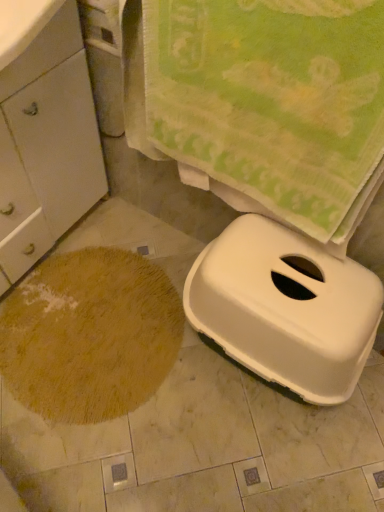
What is the approximate width of brown shaggy rug at lower left?

brown shaggy rug at lower left is 59.47 centimeters in width.

The image size is (384, 512). What do you see at coordinates (46, 145) in the screenshot?
I see `white matte cabinet at left` at bounding box center [46, 145].

You are a GUI agent. You are given a task and a screenshot of the screen. Output one action in this format:
    pyautogui.click(x=<x>, y=<y>)
    Task: Click on the white matte cabinet at left
    
    Given the screenshot: What is the action you would take?
    pyautogui.click(x=46, y=145)

You are a GUI agent. You are given a task and a screenshot of the screen. Output one action in this format:
    pyautogui.click(x=<x>, y=<y>)
    Task: Click on the green textured towel at upper center
    This screenshot has height=512, width=384.
    Given the screenshot: What is the action you would take?
    pyautogui.click(x=263, y=103)

The width and height of the screenshot is (384, 512). I want to click on brown shaggy rug at lower left, so click(x=90, y=335).

Considering the sizes of white matte cabinet at left and white plastic litter box at lower right in the image, is white matte cabinet at left wider or thinner than white plastic litter box at lower right?

In the image, white matte cabinet at left appears to be more narrow than white plastic litter box at lower right.

Is white matte cabinet at left turned away from white plastic litter box at lower right?

That's not correct — white matte cabinet at left is not looking away from white plastic litter box at lower right.

In order to click on appliance below the white matte cabinet at left (from a real-world perspective) in this screenshot , I will do `click(285, 308)`.

Considering the sizes of objects white matte cabinet at left and white plastic litter box at lower right in the image provided, who is smaller, white matte cabinet at left or white plastic litter box at lower right?

white plastic litter box at lower right.

Considering the relative positions of white matte cabinet at left and brown shaggy rug at lower left in the image provided, is white matte cabinet at left to the right of brown shaggy rug at lower left from the viewer's perspective?

No.

From the image's perspective, is white matte cabinet at left located beneath brown shaggy rug at lower left?

No.

How different are the orientations of white matte cabinet at left and brown shaggy rug at lower left in degrees?

3.28 degrees.

Which of these two, white matte cabinet at left or brown shaggy rug at lower left, stands taller?

With more height is white matte cabinet at left.

How many degrees apart are the facing directions of brown shaggy rug at lower left and white matte cabinet at left?

3.28 degrees separate the facing orientations of brown shaggy rug at lower left and white matte cabinet at left.

Between brown shaggy rug at lower left and white matte cabinet at left, which one is positioned in front?

white matte cabinet at left.

Where is `sand to the right of white matte cabinet at left`? This screenshot has height=512, width=384. sand to the right of white matte cabinet at left is located at coordinates (90, 335).

Based on the photo, would you say brown shaggy rug at lower left contains white matte cabinet at left?

Actually, white matte cabinet at left is outside brown shaggy rug at lower left.

Are white plastic litter box at lower right and brown shaggy rug at lower left beside each other?

No.

Consider the image. Does white plastic litter box at lower right come behind brown shaggy rug at lower left?

No.

Which is nearer, (329, 265) or (93, 266)?

Positioned in front is point (329, 265).

Looking at this image, can you tell me how much green textured towel at upper center and brown shaggy rug at lower left differ in facing direction?

The facing directions of green textured towel at upper center and brown shaggy rug at lower left are 92.1 degrees apart.

Is green textured towel at upper center aimed at brown shaggy rug at lower left?

No, green textured towel at upper center is not aimed at brown shaggy rug at lower left.

Considering the relative sizes of green textured towel at upper center and brown shaggy rug at lower left in the image provided, is green textured towel at upper center thinner than brown shaggy rug at lower left?

Yes, green textured towel at upper center is thinner than brown shaggy rug at lower left.

From a real-world perspective, which is physically above, green textured towel at upper center or brown shaggy rug at lower left?

green textured towel at upper center is physically above.

Is brown shaggy rug at lower left directly adjacent to white plastic litter box at lower right?

No, brown shaggy rug at lower left is not making contact with white plastic litter box at lower right.

Is brown shaggy rug at lower left in front of or behind white plastic litter box at lower right in the image?

brown shaggy rug at lower left is positioned farther from the viewer than white plastic litter box at lower right.

Based on the photo, from a real-world perspective, is brown shaggy rug at lower left physically above white plastic litter box at lower right?

Actually, brown shaggy rug at lower left is physically below white plastic litter box at lower right in the real world.

From the image's perspective, is brown shaggy rug at lower left above white plastic litter box at lower right?

No, from the image's perspective, brown shaggy rug at lower left is not above white plastic litter box at lower right.

Which object is thinner, white matte cabinet at left or green textured towel at upper center?

green textured towel at upper center.

Considering the sizes of objects white matte cabinet at left and green textured towel at upper center in the image provided, who is taller, white matte cabinet at left or green textured towel at upper center?

white matte cabinet at left.

From a real-world perspective, is white matte cabinet at left on top of green textured towel at upper center?

No, from a real-world perspective, white matte cabinet at left is not over green textured towel at upper center

Based on the photo, can you tell me how much white matte cabinet at left and green textured towel at upper center differ in facing direction?

The angular difference between white matte cabinet at left and green textured towel at upper center is 88.8 degrees.

You are a GUI agent. You are given a task and a screenshot of the screen. Output one action in this format:
    pyautogui.click(x=<x>, y=<y>)
    Task: Click on the cabinetry that is on the left side of white plastic litter box at lower right
    
    Given the screenshot: What is the action you would take?
    pyautogui.click(x=46, y=145)

Where is `cabinetry in front of the brown shaggy rug at lower left`? This screenshot has width=384, height=512. cabinetry in front of the brown shaggy rug at lower left is located at coordinates (46, 145).

Looking at the image, which one is located further to green textured towel at upper center, white plastic litter box at lower right or white matte cabinet at left?

white matte cabinet at left is further to green textured towel at upper center.

In the scene shown: From the image, which object appears to be farther from white matte cabinet at left, green textured towel at upper center or white plastic litter box at lower right?

The object further to white matte cabinet at left is white plastic litter box at lower right.

Estimate the real-world distances between objects in this image. Which object is closer to brown shaggy rug at lower left, white plastic litter box at lower right or green textured towel at upper center?

Among the two, white plastic litter box at lower right is located nearer to brown shaggy rug at lower left.

Which object lies further to the anchor point brown shaggy rug at lower left, white matte cabinet at left or white plastic litter box at lower right?

The object further to brown shaggy rug at lower left is white plastic litter box at lower right.

Estimate the real-world distances between objects in this image. Which object is further from green textured towel at upper center, white matte cabinet at left or brown shaggy rug at lower left?

brown shaggy rug at lower left is positioned further to the anchor green textured towel at upper center.

When comparing their distances from white plastic litter box at lower right, does white matte cabinet at left or green textured towel at upper center seem closer?

green textured towel at upper center lies closer to white plastic litter box at lower right than the other object.

Considering their positions, is brown shaggy rug at lower left positioned further to white plastic litter box at lower right than white matte cabinet at left?

Among the two, white matte cabinet at left is located further to white plastic litter box at lower right.

Estimate the real-world distances between objects in this image. Which object is closer to white matte cabinet at left, green textured towel at upper center or brown shaggy rug at lower left?

brown shaggy rug at lower left is closer to white matte cabinet at left.

The image size is (384, 512). In order to click on sand situated between white matte cabinet at left and green textured towel at upper center from left to right in this screenshot , I will do `click(90, 335)`.

At what (x,y) coordinates should I click in order to perform the action: click on beach towel located between brown shaggy rug at lower left and white plastic litter box at lower right in the left-right direction. Please return your answer as a coordinate pair (x, y). This screenshot has width=384, height=512. Looking at the image, I should click on (263, 103).

The height and width of the screenshot is (512, 384). I want to click on sand between white matte cabinet at left and white plastic litter box at lower right, so click(x=90, y=335).

Locate an element on the screen. This screenshot has height=512, width=384. beach towel situated between white matte cabinet at left and white plastic litter box at lower right from left to right is located at coordinates (263, 103).